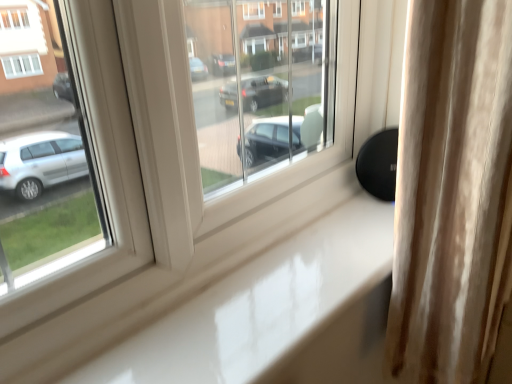
Find the location of a particular element. The width and height of the screenshot is (512, 384). beige textured curtain at right is located at coordinates (453, 192).

The width and height of the screenshot is (512, 384). Describe the element at coordinates (453, 192) in the screenshot. I see `beige textured curtain at right` at that location.

You are a GUI agent. You are given a task and a screenshot of the screen. Output one action in this format:
    pyautogui.click(x=<x>, y=<y>)
    Task: Click on the beige textured curtain at right
    Image resolution: width=512 pixels, height=384 pixels.
    Given the screenshot: What is the action you would take?
    pyautogui.click(x=453, y=192)